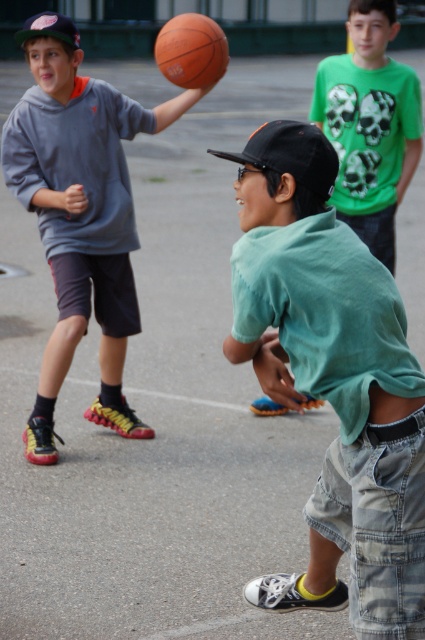
Question: Does green cotton shirt at center appear over matte gray hoodie at upper left?

Choices:
 (A) yes
 (B) no

Answer: (B)

Question: Which object appears farthest from the camera in this image?

Choices:
 (A) matte gray hoodie at upper left
 (B) green matte shirt at center

Answer: (B)

Question: In this image, where is green cotton shirt at center located relative to green matte shirt at center?

Choices:
 (A) above
 (B) below

Answer: (B)

Question: Among these points, which one is nearest to the camera?

Choices:
 (A) (25, 36)
 (B) (339, 396)
 (C) (218, 65)

Answer: (B)

Question: Estimate the real-world distances between objects in this image. Which object is closer to the green matte shirt at center?

Choices:
 (A) orange matte basketball at upper center
 (B) green cotton shirt at center

Answer: (A)

Question: Does green cotton shirt at center have a larger size compared to green matte shirt at center?

Choices:
 (A) yes
 (B) no

Answer: (A)